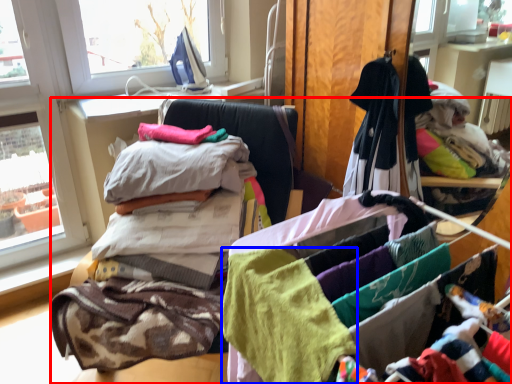
Question: Which point is closer to the camera, furniture (highlighted by a red box) or baby clothe (highlighted by a blue box)?

Choices:
 (A) furniture
 (B) baby clothe

Answer: (B)